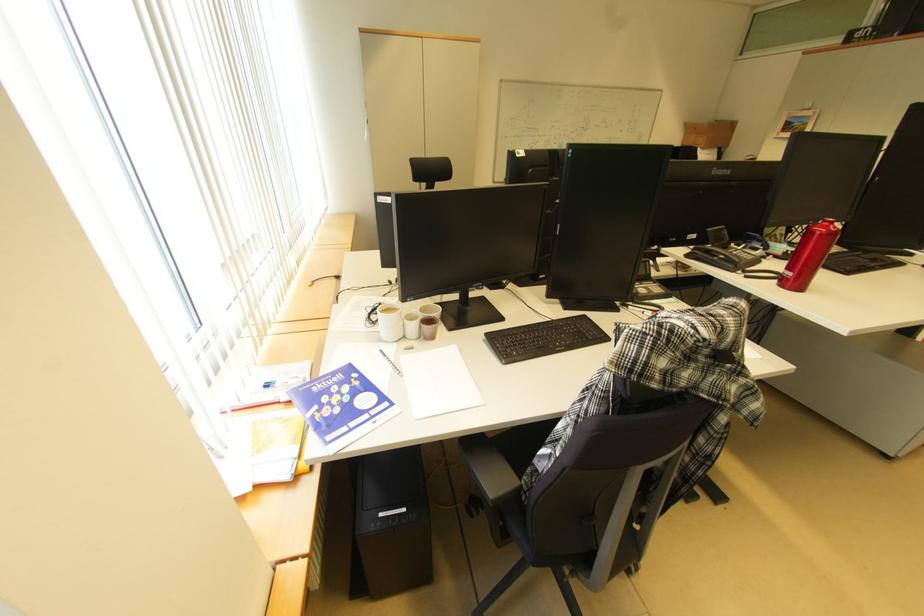
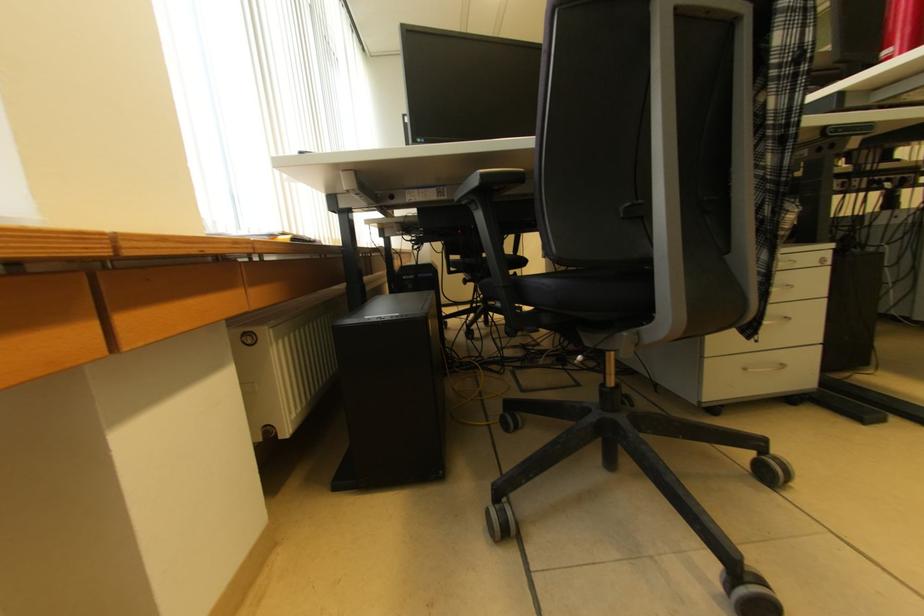
What movement of the cameraman would produce the second image?

The movement direction of the cameraman is right, forward.